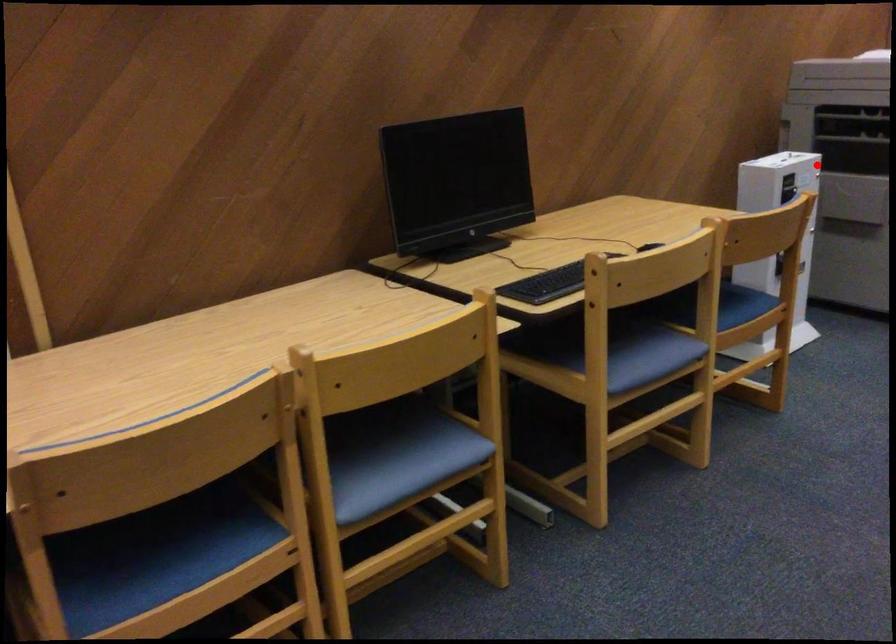
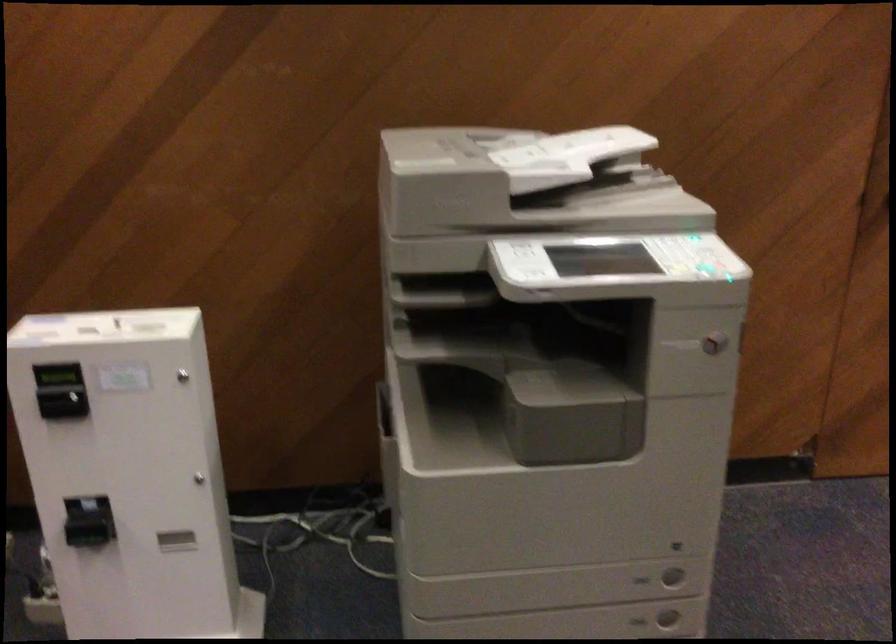
Question: A red point is marked in image1. In image2, is the corresponding 3D point closer to the camera or farther? Reply with the corresponding letter.

Choices:
 (A) The corresponding 3D point is closer.
 (B) The corresponding 3D point is farther.

Answer: (A)